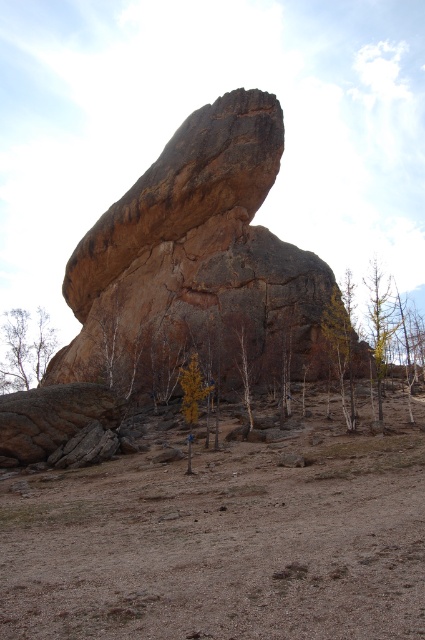
Who is lower down, brown rough bark tree at center or yellow leafy tree at center?

yellow leafy tree at center is lower down.

Which is more to the left, brown rough bark tree at center or yellow leafy tree at center?

yellow leafy tree at center

Describe the element at coordinates (241, 353) in the screenshot. I see `brown rough bark tree at center` at that location.

Locate an element on the screen. brown rough bark tree at center is located at coordinates (241, 353).

Can you confirm if brown rough rock at center is positioned above brown rough bark tree at center?

Indeed, brown rough rock at center is positioned over brown rough bark tree at center.

Who is positioned more to the left, brown rough rock at center or brown rough bark tree at center?

From the viewer's perspective, brown rough rock at center appears more on the left side.

At what (x,y) coordinates should I click in order to perform the action: click on brown rough rock at center. Please return your answer as a coordinate pair (x, y). Looking at the image, I should click on (201, 262).

You are a GUI agent. You are given a task and a screenshot of the screen. Output one action in this format:
    pyautogui.click(x=<x>, y=<y>)
    Task: Click on the brown rough rock at center
    
    Given the screenshot: What is the action you would take?
    [x=201, y=262]

The height and width of the screenshot is (640, 425). What do you see at coordinates (53, 417) in the screenshot?
I see `rusty rock at lower left` at bounding box center [53, 417].

Between point (85, 406) and point (248, 419), which one is positioned behind?

The point (248, 419) is more distant.

The width and height of the screenshot is (425, 640). I want to click on rusty rock at lower left, so click(x=53, y=417).